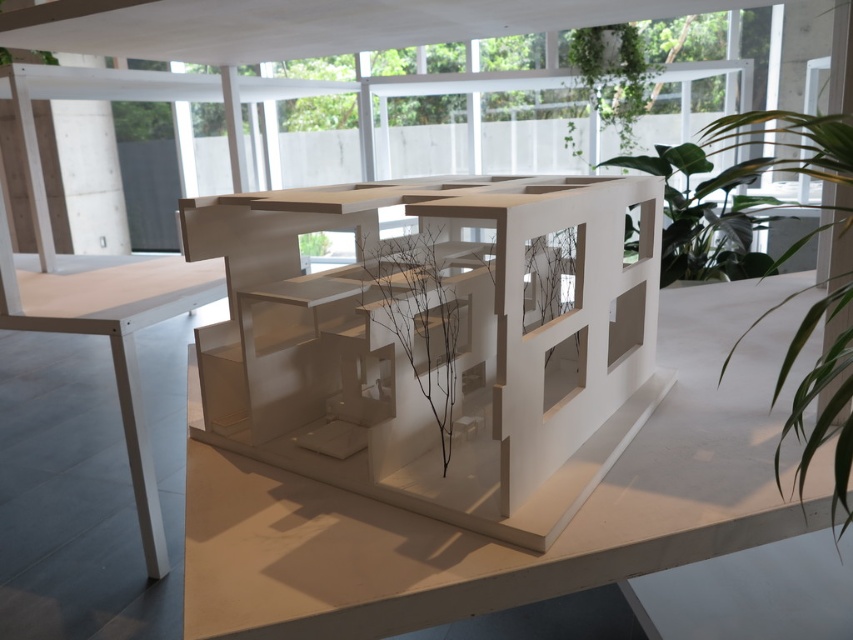
You are an architect examining the architectural model. You notice the green leafy plant at upper right and the brown matte branch at center. Which object is closer to the front of the model?

The brown matte branch at center is closer to the front of the model because the green leafy plant at upper right is behind it.

You are an architect examining the architectural model in the gallery. You need to place a scale model of a car on the white matte table at left. Is the table positioned to the left side of the model?

The white matte table at left is located at point (115, 339), which places it to the left side of the model. Yes, the table is positioned to the left side of the model.

You are standing in front of the architectural model and want to know how far the point at coordinates (392, 358) is from your eyes. Can you determine the distance?

The point at coordinates (392, 358) is 1.02 meters from the camera, so the distance from your eyes would be approximately 1.02 meters.